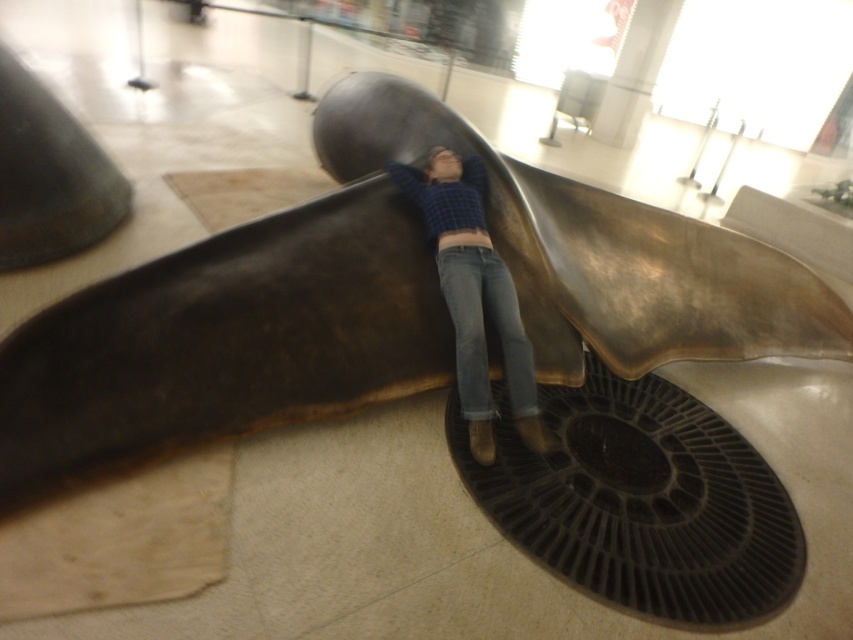
Is blue plaid shirt at center to the left of denim jeans at center from the viewer's perspective?

Indeed, blue plaid shirt at center is positioned on the left side of denim jeans at center.

Which is more to the left, blue plaid shirt at center or denim jeans at center?

From the viewer's perspective, blue plaid shirt at center appears more on the left side.

Who is more forward, (434, 161) or (469, 273)?

Point (469, 273) is more forward.

In order to click on blue plaid shirt at center in this screenshot , I will do `click(474, 296)`.

Is shiny bronze sculpture at center to the left of blue plaid shirt at center from the viewer's perspective?

In fact, shiny bronze sculpture at center is to the right of blue plaid shirt at center.

Is shiny bronze sculpture at center further to camera compared to blue plaid shirt at center?

Yes, it is.

Is point (76, 410) positioned behind point (465, 228)?

No.

In order to click on shiny bronze sculpture at center in this screenshot , I will do `click(376, 305)`.

The image size is (853, 640). I want to click on shiny bronze sculpture at center, so click(x=376, y=305).

Locate an element on the screen. The width and height of the screenshot is (853, 640). shiny bronze sculpture at center is located at coordinates (376, 305).